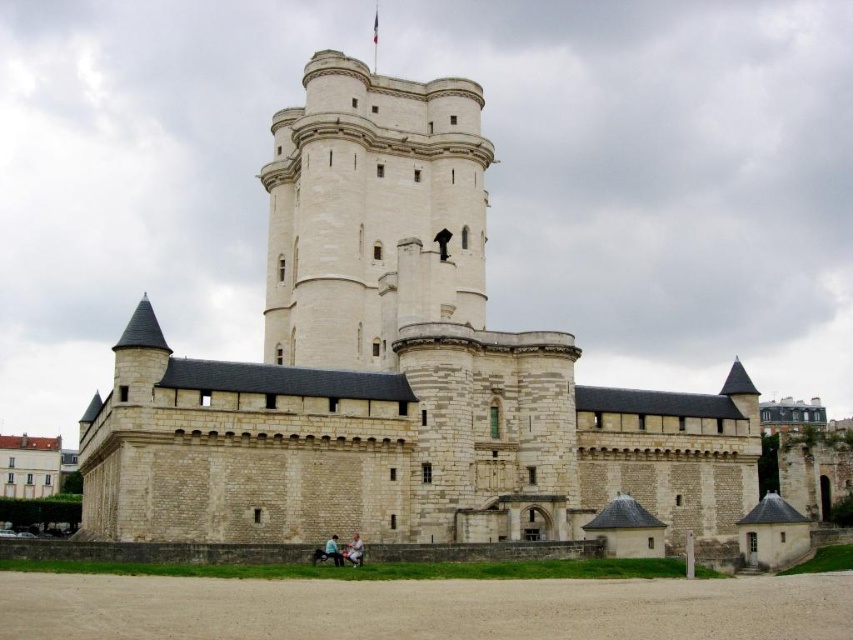
Question: Does white stone castle at center appear on the left side of white stone tower at center?

Choices:
 (A) yes
 (B) no

Answer: (A)

Question: Considering the real-world distances, which object is farthest from the white stone tower at center?

Choices:
 (A) light blue denim jeans at lower center
 (B) white stone castle at center

Answer: (A)

Question: Which object is positioned closest to the light blue denim jeans at lower center?

Choices:
 (A) white stone castle at center
 (B) white stone tower at center
 (C) light brown leather jacket at lower center

Answer: (C)

Question: Is white stone castle at center in front of light brown leather jacket at lower center?

Choices:
 (A) no
 (B) yes

Answer: (A)

Question: Considering the relative positions of white stone tower at center and light blue denim jeans at lower center in the image provided, where is white stone tower at center located with respect to light blue denim jeans at lower center?

Choices:
 (A) above
 (B) below

Answer: (A)

Question: Based on their relative distances, which object is farther from the light blue denim jeans at lower center?

Choices:
 (A) white stone tower at center
 (B) white stone castle at center

Answer: (A)